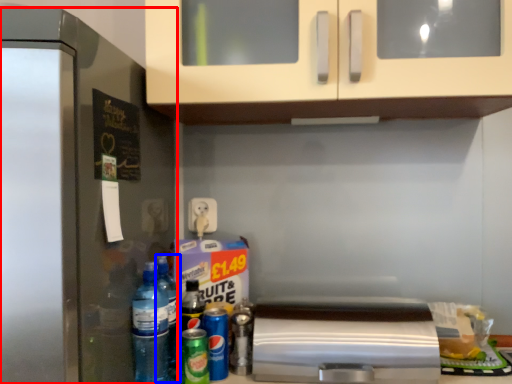
Question: Among these objects, which one is nearest to the camera, refrigerator (highlighted by a red box) or bottle (highlighted by a blue box)?

Choices:
 (A) refrigerator
 (B) bottle

Answer: (A)